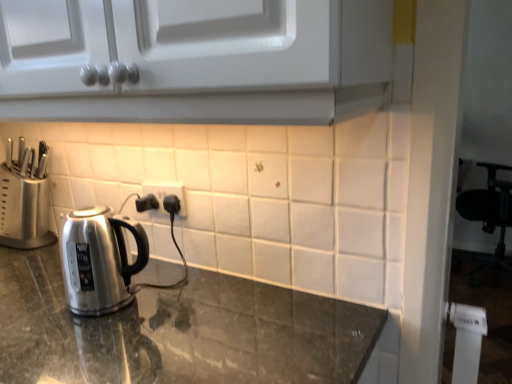
Question: Does shiny granite countertop at center appear on the right side of satin silver knife block at left?

Choices:
 (A) yes
 (B) no

Answer: (A)

Question: Does shiny granite countertop at center have a smaller size compared to satin silver knife block at left?

Choices:
 (A) no
 (B) yes

Answer: (A)

Question: Is shiny granite countertop at center shorter than satin silver knife block at left?

Choices:
 (A) yes
 (B) no

Answer: (B)

Question: From the image's perspective, is shiny granite countertop at center under satin silver knife block at left?

Choices:
 (A) yes
 (B) no

Answer: (A)

Question: Is shiny granite countertop at center wider than satin silver knife block at left?

Choices:
 (A) no
 (B) yes

Answer: (B)

Question: From a real-world perspective, is satin silver knife block at left positioned above or below shiny granite countertop at center?

Choices:
 (A) below
 (B) above

Answer: (B)

Question: From their relative heights in the image, would you say satin silver knife block at left is taller or shorter than shiny granite countertop at center?

Choices:
 (A) tall
 (B) short

Answer: (B)

Question: Is point tap(22, 220) positioned closer to the camera than point tap(166, 299)?

Choices:
 (A) farther
 (B) closer

Answer: (A)

Question: Is satin silver knife block at left in front of or behind shiny granite countertop at center in the image?

Choices:
 (A) front
 (B) behind

Answer: (B)

Question: Is point (146, 190) closer or farther from the camera than point (30, 193)?

Choices:
 (A) closer
 (B) farther

Answer: (A)

Question: From the image's perspective, relative to satin silver knife block at left, is white plastic electric outlet at center above or below?

Choices:
 (A) above
 (B) below

Answer: (B)

Question: Is white plastic electric outlet at center spatially inside satin silver knife block at left, or outside of it?

Choices:
 (A) inside
 (B) outside

Answer: (B)

Question: Would you say white plastic electric outlet at center is to the left or to the right of satin silver knife block at left in the picture?

Choices:
 (A) left
 (B) right

Answer: (B)

Question: In terms of width, does white plastic electric outlet at center look wider or thinner when compared to shiny granite countertop at center?

Choices:
 (A) wide
 (B) thin

Answer: (B)

Question: Considering their positions, is white plastic electric outlet at center located in front of or behind shiny granite countertop at center?

Choices:
 (A) front
 (B) behind

Answer: (B)